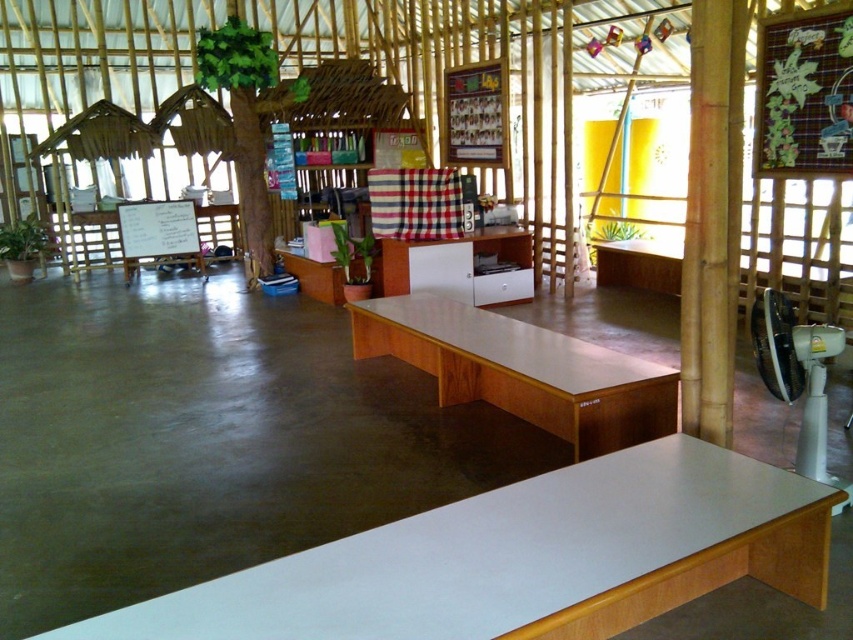
Who is shorter, light brown wood table at center or white glossy cabinet at center?

white glossy cabinet at center is shorter.

At what (x,y) coordinates should I click in order to perform the action: click on light brown wood table at center. Please return your answer as a coordinate pair (x, y). Looking at the image, I should click on (521, 371).

Describe the element at coordinates (524, 557) in the screenshot. The height and width of the screenshot is (640, 853). I see `white glossy table at lower center` at that location.

Who is positioned more to the left, white glossy table at lower center or light brown wood table at center?

white glossy table at lower center

Between point (326, 560) and point (676, 403), which one is positioned behind?

Point (676, 403)

Identify the location of white glossy table at lower center. Image resolution: width=853 pixels, height=640 pixels. (524, 557).

From the picture: Who is positioned more to the left, white glossy table at lower center or white glossy cabinet at center?

white glossy table at lower center

Is point (735, 461) closer to camera compared to point (520, 266)?

That is True.

Where is `white glossy table at lower center`? This screenshot has height=640, width=853. white glossy table at lower center is located at coordinates (524, 557).